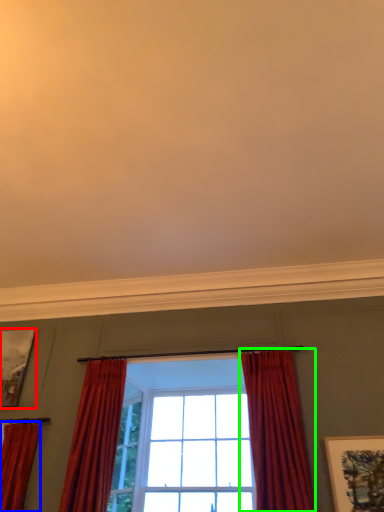
Question: Based on their relative distances, which object is farther from picture frame (highlighted by a red box)? Choose from curtain (highlighted by a blue box) and curtain (highlighted by a green box).

Choices:
 (A) curtain
 (B) curtain

Answer: (B)